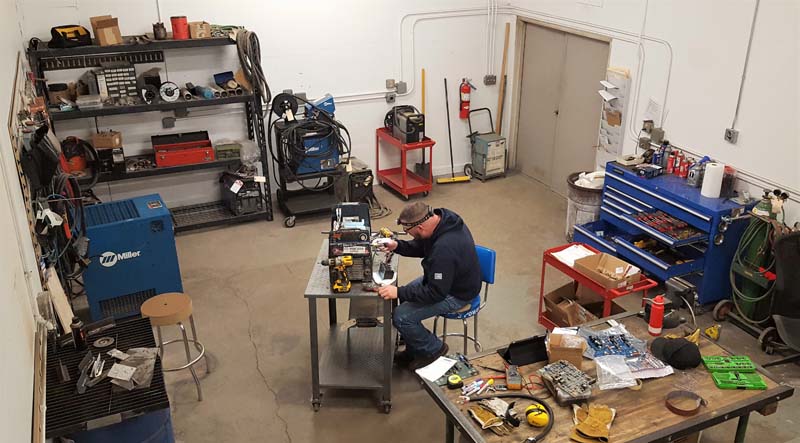
What are the coordinates of `door` in the screenshot? It's located at (566, 86).